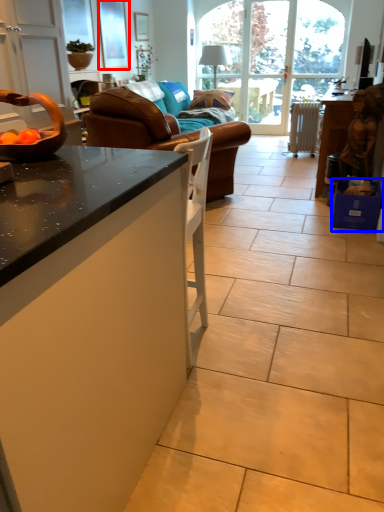
Question: Which of the following is the farthest to the observer, picture frame (highlighted by a red box) or box (highlighted by a blue box)?

Choices:
 (A) picture frame
 (B) box

Answer: (A)